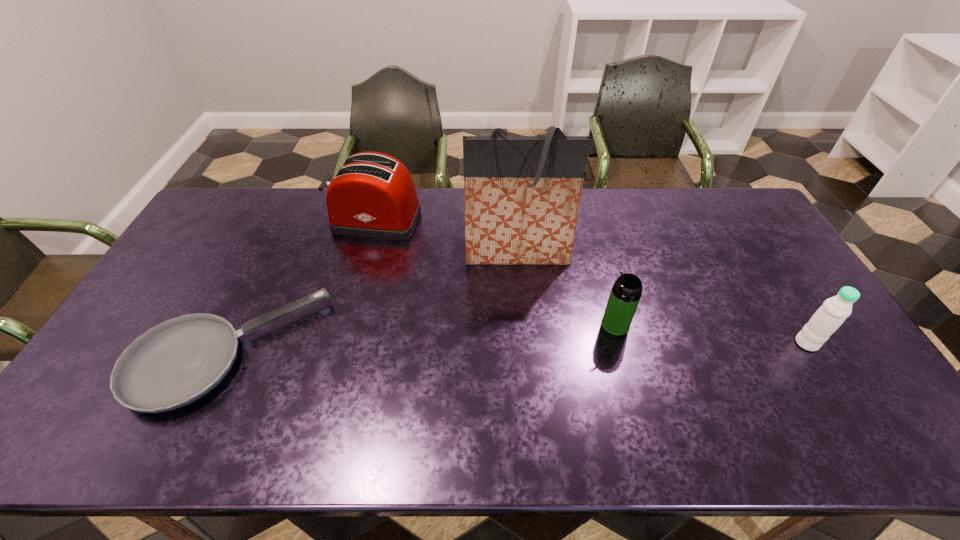
You are a GUI agent. You are given a task and a screenshot of the screen. Output one action in this format:
    pyautogui.click(x=<x>, y=<y>)
    Task: Click on the vacant region located from the spout of the fourth object from left to right
    The width and height of the screenshot is (960, 540).
    Given the screenshot: What is the action you would take?
    pyautogui.click(x=573, y=325)

The height and width of the screenshot is (540, 960). In order to click on free spot located 0.220m from the spout of the fourth object from left to right in this screenshot , I will do `click(523, 325)`.

Identify the location of free spot located 0.050m on the left of the frying pan. This screenshot has width=960, height=540. (118, 352).

Locate an element on the screen. Image resolution: width=960 pixels, height=540 pixels. object situated at the far edge is located at coordinates (372, 195).

Locate an element on the screen. The height and width of the screenshot is (540, 960). object that is at the near edge is located at coordinates (173, 364).

You are a GUI agent. You are given a task and a screenshot of the screen. Output one action in this format:
    pyautogui.click(x=<x>, y=<y>)
    Task: Click on the object that is at the left edge
    
    Given the screenshot: What is the action you would take?
    pyautogui.click(x=173, y=364)

At what (x,y) coordinates should I click in order to perform the action: click on object that is at the right edge. Please return your answer as a coordinate pair (x, y). This screenshot has width=960, height=540. Looking at the image, I should click on (828, 318).

Find the location of `object located at the near left corner`. object located at the near left corner is located at coordinates (173, 364).

At what (x,y) coordinates should I click in order to perform the action: click on vacant region at the far edge of the desktop. Please return your answer as a coordinate pair (x, y). This screenshot has height=540, width=960. Looking at the image, I should click on (325, 199).

I want to click on free region at the near edge of the desktop, so click(523, 427).